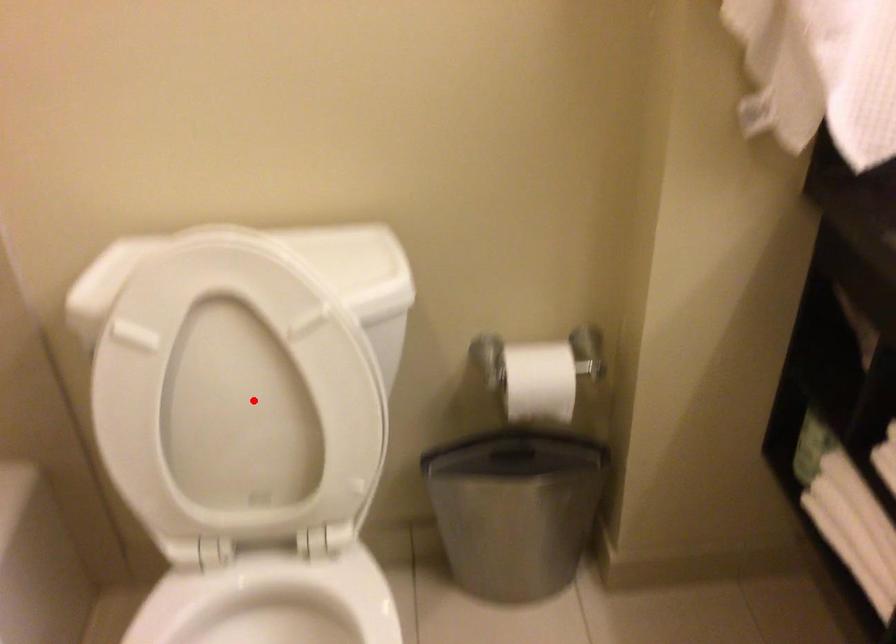
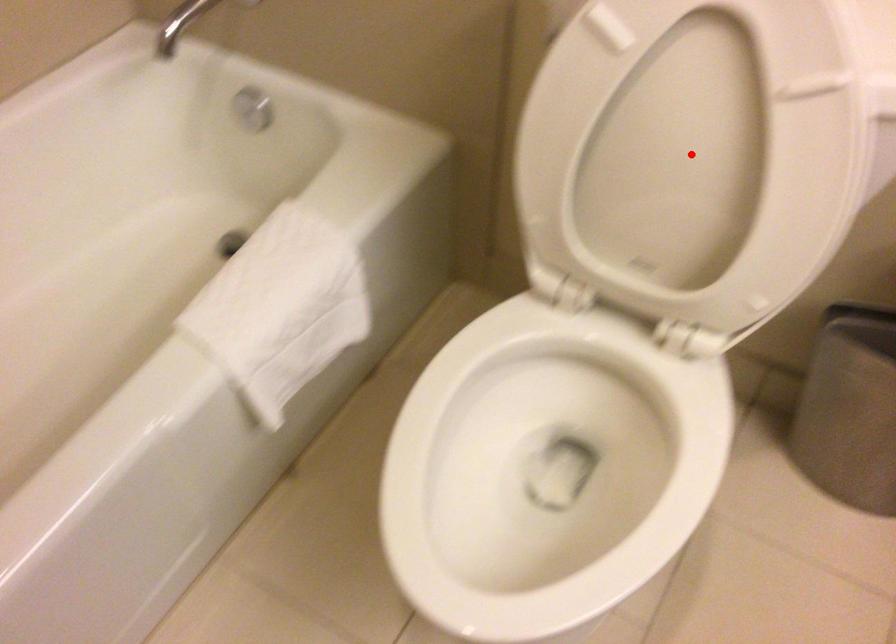
I am providing you with two images of the same scene from different viewpoints. A red point is marked on the first image and another point is marked on the second image. Is the marked point in image1 the same physical position as the marked point in image2?

Yes